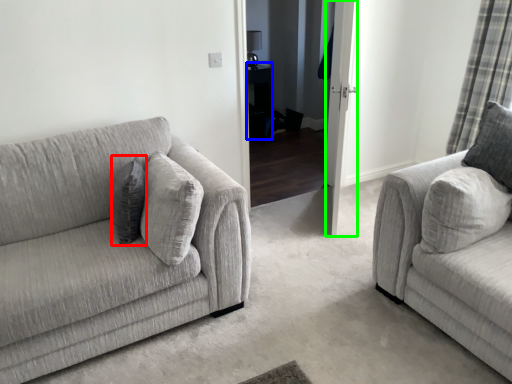
Question: Estimate the real-world distances between objects in this image. Which object is farther from pillow (highlighted by a red box), table (highlighted by a blue box) or glass door (highlighted by a green box)?

Choices:
 (A) table
 (B) glass door

Answer: (A)